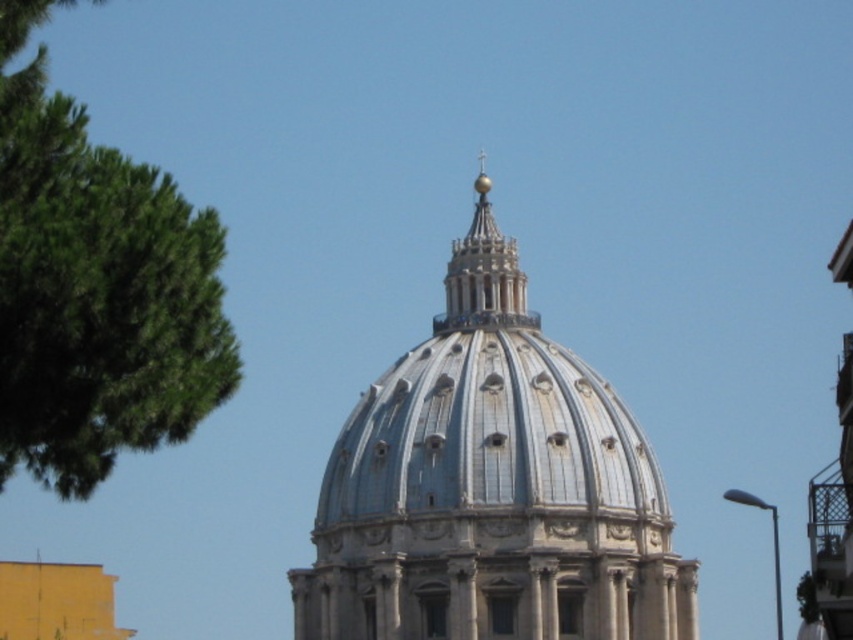
Question: Can you confirm if green leafy tree at left is positioned below gold polished dome at upper center?

Choices:
 (A) no
 (B) yes

Answer: (B)

Question: Which point is closer to the camera taking this photo?

Choices:
 (A) (45, 113)
 (B) (368, 572)

Answer: (A)

Question: Can you confirm if white stone dome at center is positioned below gold polished dome at upper center?

Choices:
 (A) yes
 (B) no

Answer: (A)

Question: Which point is closer to the camera taking this photo?

Choices:
 (A) (135, 410)
 (B) (474, 284)
 (C) (346, 598)

Answer: (A)

Question: Is green leafy tree at left smaller than gold polished dome at upper center?

Choices:
 (A) no
 (B) yes

Answer: (A)

Question: Which object appears farthest from the camera in this image?

Choices:
 (A) green leafy tree at left
 (B) white stone dome at center
 (C) gold polished dome at upper center

Answer: (C)